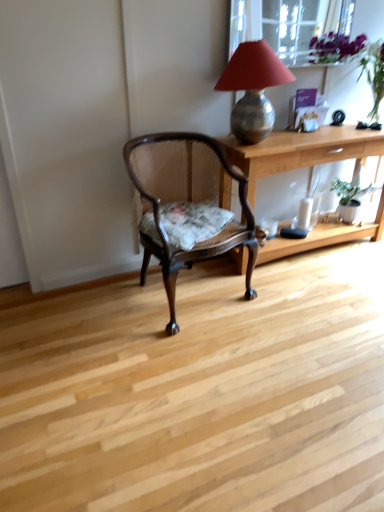
Where is `free space between mahogany cane chair at center and light wood desk at center`? The image size is (384, 512). free space between mahogany cane chair at center and light wood desk at center is located at coordinates (292, 276).